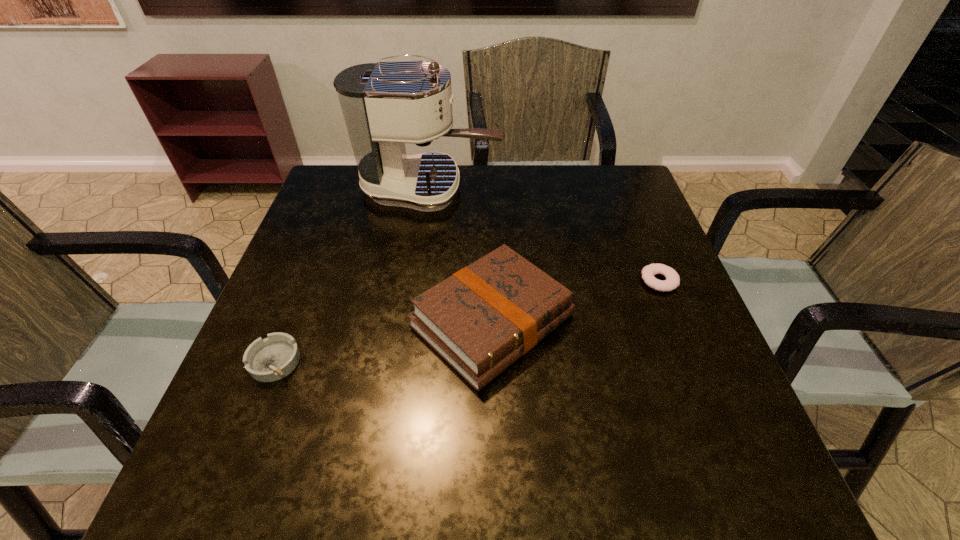
You are a GUI agent. You are given a task and a screenshot of the screen. Output one action in this format:
    pyautogui.click(x=<x>, y=<y>)
    Task: Click on the free spot between the ashtray and the hardback book
    The image size is (960, 540).
    Given the screenshot: What is the action you would take?
    pyautogui.click(x=384, y=341)

Find the location of a particular element. The height and width of the screenshot is (540, 960). free point between the third shortest object and the shortest object is located at coordinates (576, 301).

This screenshot has width=960, height=540. I want to click on object identified as the second closest to the second shortest object, so click(386, 104).

You are a GUI agent. You are given a task and a screenshot of the screen. Output one action in this format:
    pyautogui.click(x=<x>, y=<y>)
    Task: Click on the object that can be found as the closest to the third tallest object
    The height and width of the screenshot is (540, 960).
    Given the screenshot: What is the action you would take?
    pyautogui.click(x=483, y=318)

This screenshot has width=960, height=540. What are the coordinates of `free spot that satisfies the following two spatial constraints: 1. on the back side of the leftmost object; 2. on the right side of the hardback book` in the screenshot? It's located at (291, 321).

Where is `free space that satisfies the following two spatial constraints: 1. on the front-facing side of the coffee maker; 2. on the left side of the shortest object`? free space that satisfies the following two spatial constraints: 1. on the front-facing side of the coffee maker; 2. on the left side of the shortest object is located at coordinates (417, 281).

In order to click on vacant area in the image that satisfies the following two spatial constraints: 1. on the back side of the hardback book; 2. on the right side of the rightmost object in this screenshot , I will do pyautogui.click(x=492, y=281).

Image resolution: width=960 pixels, height=540 pixels. I want to click on free space in the image that satisfies the following two spatial constraints: 1. on the back side of the doughnut; 2. on the front-facing side of the tallest object, so click(622, 189).